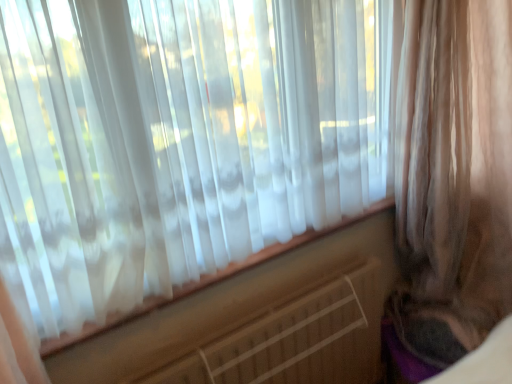
Identify the location of sheer beige curtain at right. This screenshot has width=512, height=384. (455, 186).

Image resolution: width=512 pixels, height=384 pixels. What do you see at coordinates (455, 186) in the screenshot?
I see `sheer beige curtain at right` at bounding box center [455, 186].

The width and height of the screenshot is (512, 384). Describe the element at coordinates (307, 338) in the screenshot. I see `white plastic radiator at center` at that location.

Where is `white plastic radiator at center`? white plastic radiator at center is located at coordinates (307, 338).

In order to face white plastic radiator at center, should I rotate leftwards or rightwards?

A 3.351 degree turn to the right will do.

Where is `sheer beige curtain at right`? The height and width of the screenshot is (384, 512). sheer beige curtain at right is located at coordinates (455, 186).

In the scene shown: Is sheer beige curtain at right to the left of white plastic radiator at center from the viewer's perspective?

Incorrect, sheer beige curtain at right is not on the left side of white plastic radiator at center.

Does sheer beige curtain at right come in front of white plastic radiator at center?

Yes, sheer beige curtain at right is closer to the camera.

Between point (442, 325) and point (301, 357), which one is positioned behind?

The point (442, 325) is farther from the camera.

From the image's perspective, is sheer beige curtain at right above white plastic radiator at center?

Correct, sheer beige curtain at right appears higher than white plastic radiator at center in the image.

From a real-world perspective, does sheer beige curtain at right stand above white plastic radiator at center?

Yes, from a real-world perspective, sheer beige curtain at right is over white plastic radiator at center

Does sheer beige curtain at right have a greater width compared to white plastic radiator at center?

Indeed, sheer beige curtain at right has a greater width compared to white plastic radiator at center.

Can you confirm if sheer beige curtain at right is taller than white plastic radiator at center?

Yes.

Is sheer beige curtain at right bigger or smaller than white plastic radiator at center?

In the image, sheer beige curtain at right appears to be larger than white plastic radiator at center.

Is white plastic radiator at center inside sheer beige curtain at right?

That's incorrect, white plastic radiator at center is not inside sheer beige curtain at right.

Does sheer beige curtain at right touch white plastic radiator at center?

sheer beige curtain at right is not next to white plastic radiator at center, and they're not touching.

Is sheer beige curtain at right looking in the opposite direction of white plastic radiator at center?

No, sheer beige curtain at right is not facing away from white plastic radiator at center.

Locate an element on the screen. curtain in front of the white plastic radiator at center is located at coordinates (455, 186).

Is white plastic radiator at center at the left side of sheer beige curtain at right?

Indeed, white plastic radiator at center is positioned on the left side of sheer beige curtain at right.

Which object is more forward, white plastic radiator at center or sheer beige curtain at right?

sheer beige curtain at right.

Is point (327, 372) farther from camera compared to point (496, 111)?

That is True.

From the picture: From the image's perspective, would you say white plastic radiator at center is positioned over sheer beige curtain at right?

No, from the image's perspective, white plastic radiator at center is not over sheer beige curtain at right.

From a real-world perspective, is white plastic radiator at center under sheer beige curtain at right?

Yes, from a real-world perspective, white plastic radiator at center is under sheer beige curtain at right.

Which of these two, white plastic radiator at center or sheer beige curtain at right, is thinner?

white plastic radiator at center.

In terms of height, does white plastic radiator at center look taller or shorter compared to sheer beige curtain at right?

Clearly, white plastic radiator at center is shorter compared to sheer beige curtain at right.

Who is smaller, white plastic radiator at center or sheer beige curtain at right?

With smaller size is white plastic radiator at center.

Is white plastic radiator at center completely or partially outside of sheer beige curtain at right?

white plastic radiator at center is positioned outside sheer beige curtain at right.

Are white plastic radiator at center and sheer beige curtain at right beside each other?

white plastic radiator at center and sheer beige curtain at right are not in contact.

Is white plastic radiator at center oriented towards sheer beige curtain at right?

No, white plastic radiator at center is not oriented towards sheer beige curtain at right.

You are a GUI agent. You are given a task and a screenshot of the screen. Output one action in this format:
    pyautogui.click(x=<x>, y=<y>)
    Task: Click on the curtain lying in front of the white plastic radiator at center
    
    Given the screenshot: What is the action you would take?
    pyautogui.click(x=455, y=186)

Locate an element on the screen. The width and height of the screenshot is (512, 384). curtain located above the white plastic radiator at center (from the image's perspective) is located at coordinates (455, 186).

Image resolution: width=512 pixels, height=384 pixels. In order to click on curtain located above the white plastic radiator at center (from a real-world perspective) in this screenshot , I will do `click(455, 186)`.